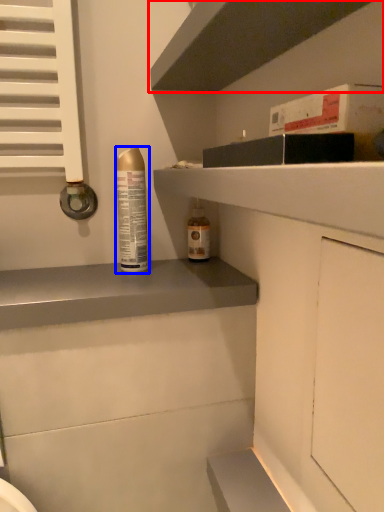
Question: Which object appears farthest to the camera in this image, shelf (highlighted by a red box) or bottle (highlighted by a blue box)?

Choices:
 (A) shelf
 (B) bottle

Answer: (B)